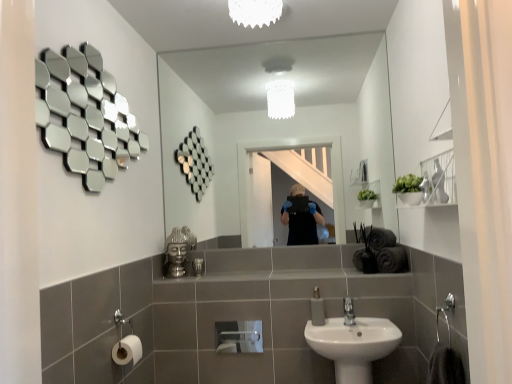
Locate an element on the screen. vacant space that's between white matte soap dispenser at lower center and silver metallic faucet at lower center is located at coordinates (332, 322).